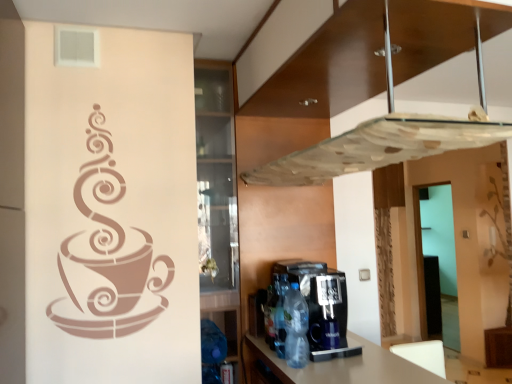
Question: From their relative heights in the image, would you say transparent glass exhaust hood at upper center is taller or shorter than black plastic coffee machine at lower center?

Choices:
 (A) tall
 (B) short

Answer: (B)

Question: From the image's perspective, is transparent glass exhaust hood at upper center positioned above or below black plastic coffee machine at lower center?

Choices:
 (A) below
 (B) above

Answer: (B)

Question: Considering the real-world distances, which object is closest to the transparent glass door at right?

Choices:
 (A) transparent glass exhaust hood at upper center
 (B) black plastic coffee machine at lower center
 (C) translucent plastic bottle at center, which ranks as the 2th bottle in back-to-front order
 (D) translucent plastic bottle at center, which ranks as the 1th bottle in back-to-front order
 (E) translucent plastic bottle at lower center, which is the 1th bottle from front to back

Answer: (B)

Question: Which of these objects is positioned farthest from the translucent plastic bottle at center, which appears as the third bottle when viewed from the front?

Choices:
 (A) transparent glass door at right
 (B) translucent plastic bottle at center, which ranks as the 2th bottle in back-to-front order
 (C) black plastic coffee machine at lower center
 (D) translucent plastic bottle at lower center, which is the 1th bottle from front to back
 (E) transparent glass exhaust hood at upper center

Answer: (A)